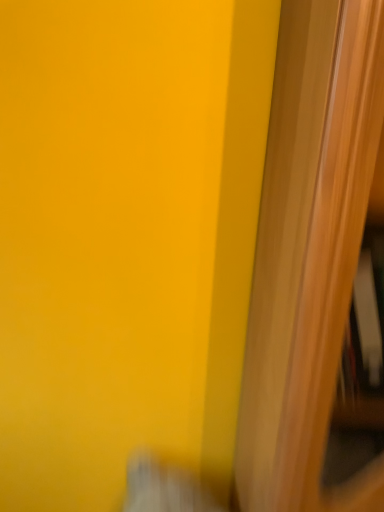
What do you see at coordinates (309, 253) in the screenshot?
I see `wooden door at right` at bounding box center [309, 253].

Image resolution: width=384 pixels, height=512 pixels. I want to click on wooden door at right, so click(309, 253).

The image size is (384, 512). In order to click on wooden door at right in this screenshot , I will do `click(309, 253)`.